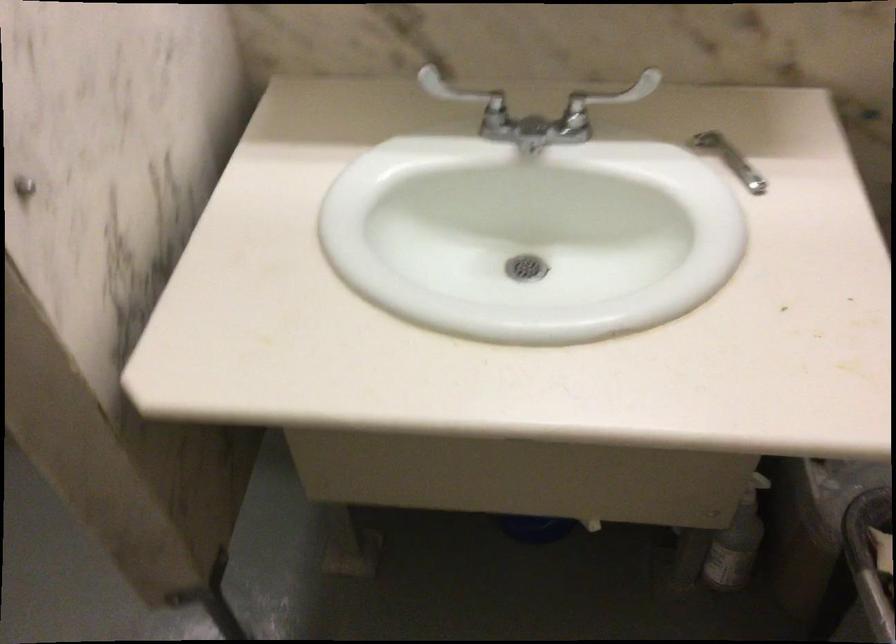
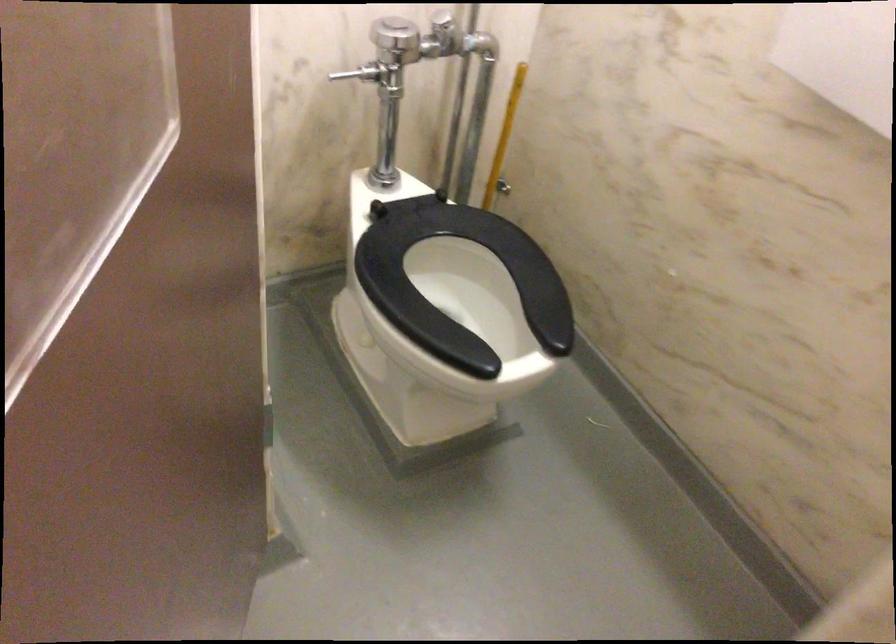
Question: Based on the continuous images, in which direction is the camera rotating? Reply with the corresponding letter.

Choices:
 (A) Left
 (B) Right
 (C) Up
 (D) Down

Answer: (A)